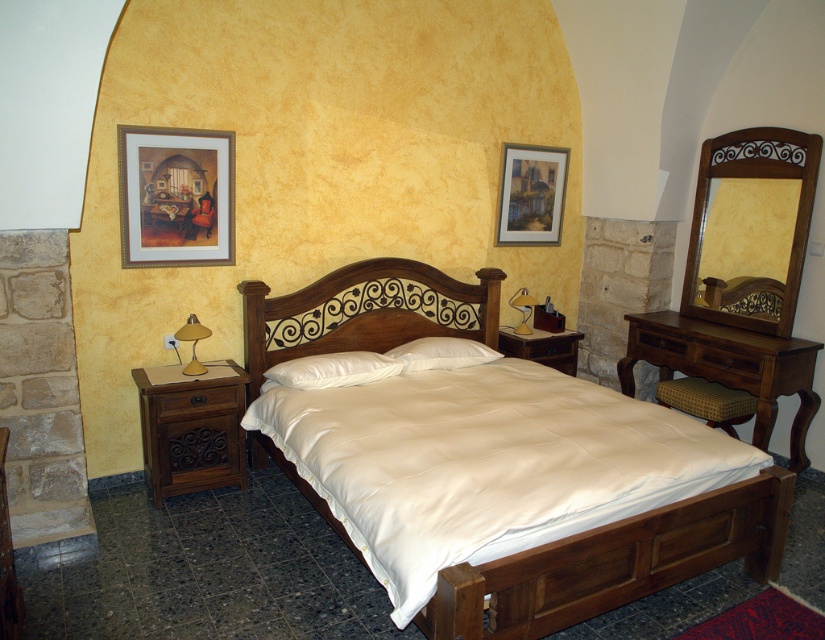
You are designing a new bedroom layout and want to ensure that the wooden bed frame at center and the wooden picture frame at upper center fit within the room. Based on their widths, which object requires more horizontal space?

The wooden bed frame at center requires more horizontal space because its width surpasses that of the wooden picture frame at upper center.

Based on the coordinates provided in the description, where is the wooden carved headboard at center located in the bedroom?

The wooden carved headboard at center is located at point coordinates of (366, 310).